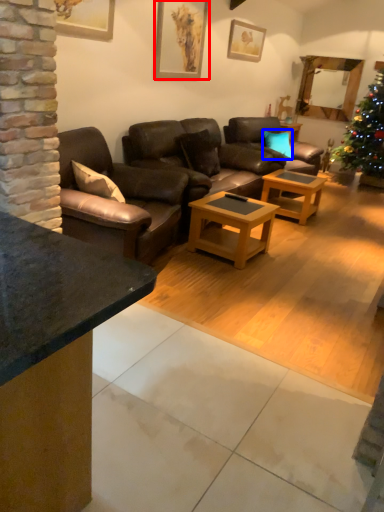
Question: Which object appears farthest to the camera in this image, picture frame (highlighted by a red box) or pillow (highlighted by a blue box)?

Choices:
 (A) picture frame
 (B) pillow

Answer: (B)